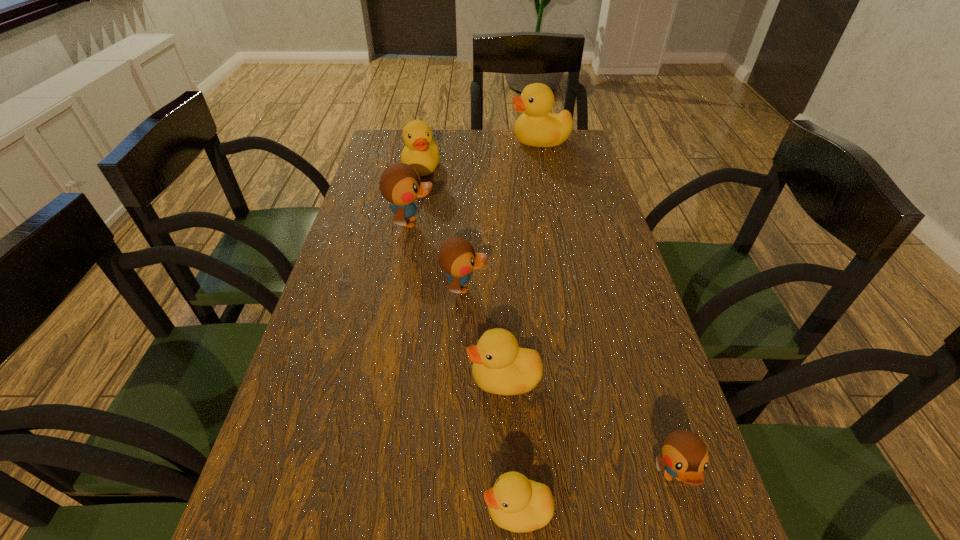
The image size is (960, 540). I want to click on vacant area situated at the beak of the second smallest yellow duck, so click(347, 379).

The image size is (960, 540). In order to click on vacant space situated 0.270m at the beak of the second smallest yellow duck in this screenshot , I will do `click(331, 379)`.

Find the location of a particular element. vacant space situated 0.050m on the front-facing side of the rightmost blue duck is located at coordinates point(692,539).

Identify the location of vacant space located 0.130m at the beak of the smallest yellow duck. This screenshot has width=960, height=540. (401, 510).

I want to click on vacant space situated at the beak of the smallest yellow duck, so click(281, 510).

Identify the location of blank space located 0.250m at the beak of the smallest yellow duck. (325, 510).

The height and width of the screenshot is (540, 960). Identify the location of object that is at the far left corner. (421, 152).

Where is `object that is at the far right corner`? object that is at the far right corner is located at coordinates (536, 127).

I want to click on blank area at the far edge, so click(x=441, y=158).

In the image, there is a desktop. Identify the location of vacant space at the left edge. The image size is (960, 540). (357, 202).